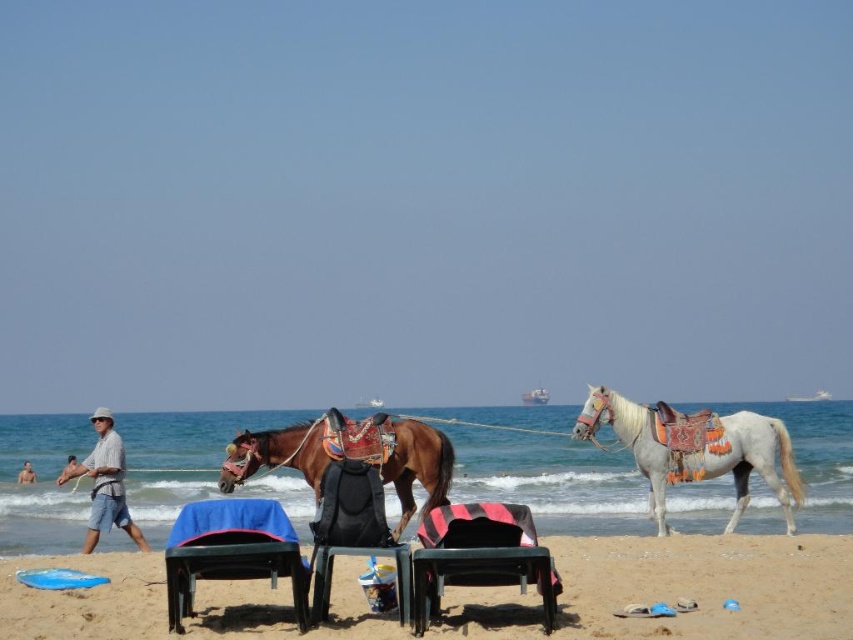
Question: Which point is farther to the camera?

Choices:
 (A) (22, 472)
 (B) (100, 474)
 (C) (573, 611)

Answer: (A)

Question: Can you confirm if sandy beach at lower center is positioned to the left of light blue denim shorts at lower left?

Choices:
 (A) yes
 (B) no

Answer: (B)

Question: Can you confirm if brown glossy saddle at center is positioned above black fabric chair at center?

Choices:
 (A) yes
 (B) no

Answer: (B)

Question: Which of the following is the farthest from the observer?

Choices:
 (A) (334, 532)
 (B) (94, 504)
 (C) (177, 518)

Answer: (C)

Question: Does blue fabric-covered chair at center appear under black fabric chair at center?

Choices:
 (A) no
 (B) yes

Answer: (B)

Question: Which point is closer to the camera taking this photo?

Choices:
 (A) (566, 628)
 (B) (22, 480)
 (C) (277, 461)
 (D) (527, 513)

Answer: (A)